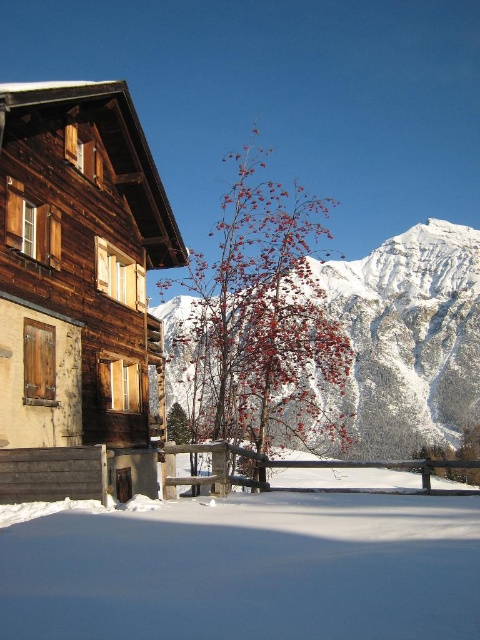
You are standing in a winter landscape and want to take a photo of the wooden chalet at left. If your camera can focus on objects up to 100 feet away, will you need to move closer to take a clear picture?

The wooden chalet at left is 121.36 feet away from the viewer, which is beyond the camera focus range of 100 feet. Therefore, you need to move closer to ensure the wooden chalet at left is within the focus range.

You are planning to build a small garden between the wooden chalet at left and the white powdery snow at lower center. Which area has more space for plants?

The white powdery snow at lower center has more space for plants since its width is greater than the wooden chalet at left.

You are standing at the entrance of the chalet and want to place a small decorative snowman on the white powdery snow at lower center. Is there enough space to place it without it being on the wooden fence or the bench?

The white powdery snow at lower center is located at point (247,570). Since the coordinates indicate it is at the lower center of the image, there should be sufficient space to place the snowman there without it overlapping with the wooden fence or the bench, which are positioned closer to the chalet and under it respectively.